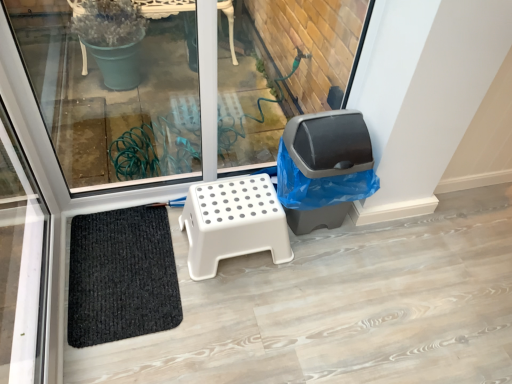
You are a GUI agent. You are given a task and a screenshot of the screen. Output one action in this format:
    pyautogui.click(x=<x>, y=<y>)
    Task: Click on the vacant space in front of gray plastic trash can at center right
    Image resolution: width=512 pixels, height=384 pixels.
    Given the screenshot: What is the action you would take?
    pyautogui.click(x=315, y=278)